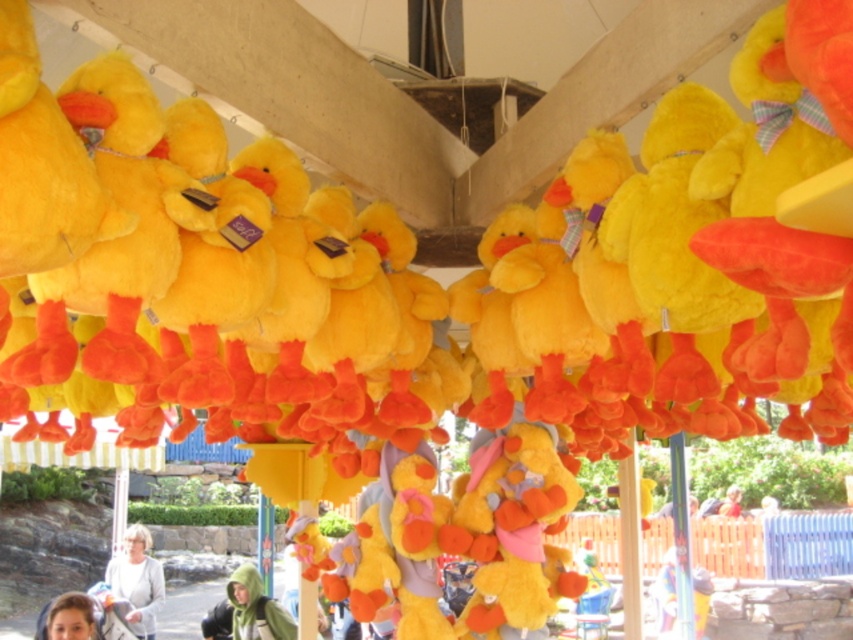
You are a photographer trying to capture both the matte green hoodie at lower center and the smooth skin face at lower left in a single shot. Based on their positions, which object should you focus on first to ensure both are in frame?

The matte green hoodie at lower center is below the smooth skin face at lower left, so you should focus on the smooth skin face at lower left first to ensure both are in frame.

You are a photographer at the carnival and want to take a photo of the smooth skin face at lower left without any obstructions. Since the matte gray sweater at lower left is in the way, should you move the sweater or the face to achieve this?

The smooth skin face at lower left is behind the matte gray sweater at lower left. To take a photo of the smooth skin face at lower left without obstructions, you should move the matte gray sweater at lower left out of the way.